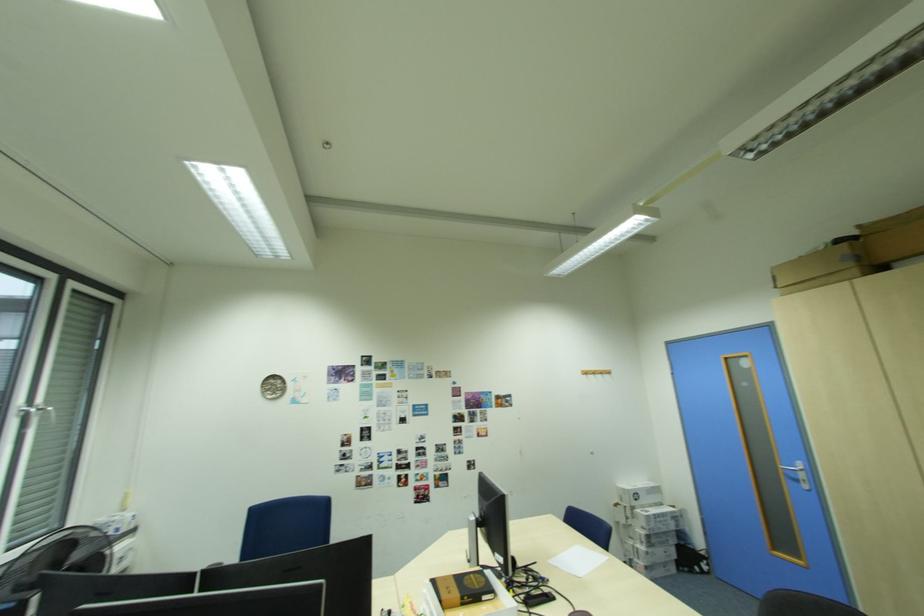
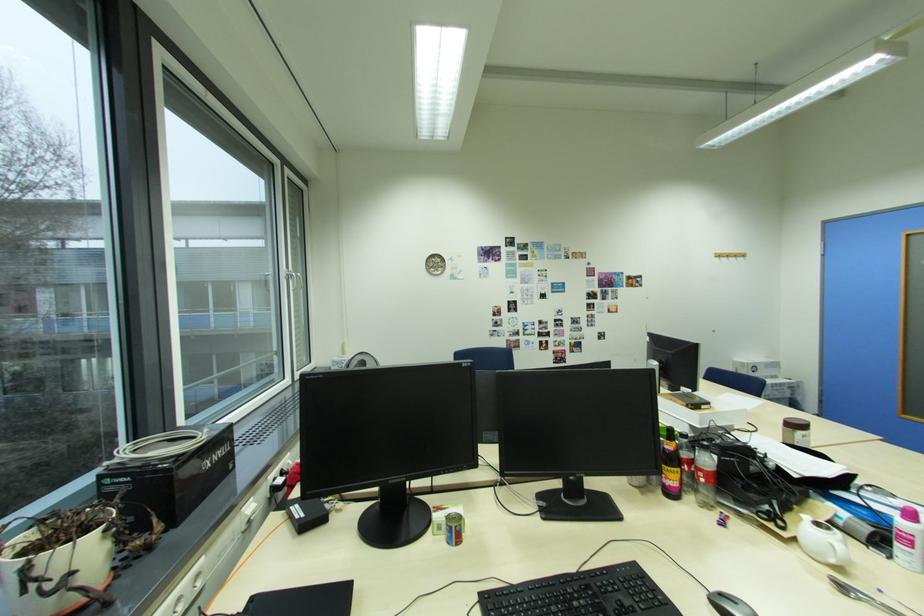
The images are taken continuously from a first-person perspective. In which direction are you moving?

The cameraman moved toward left, backward.